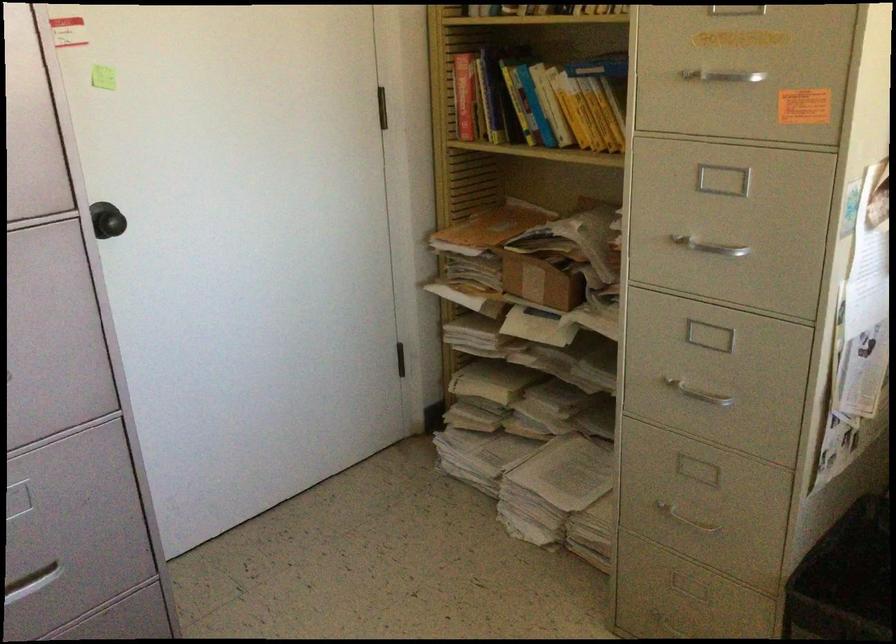
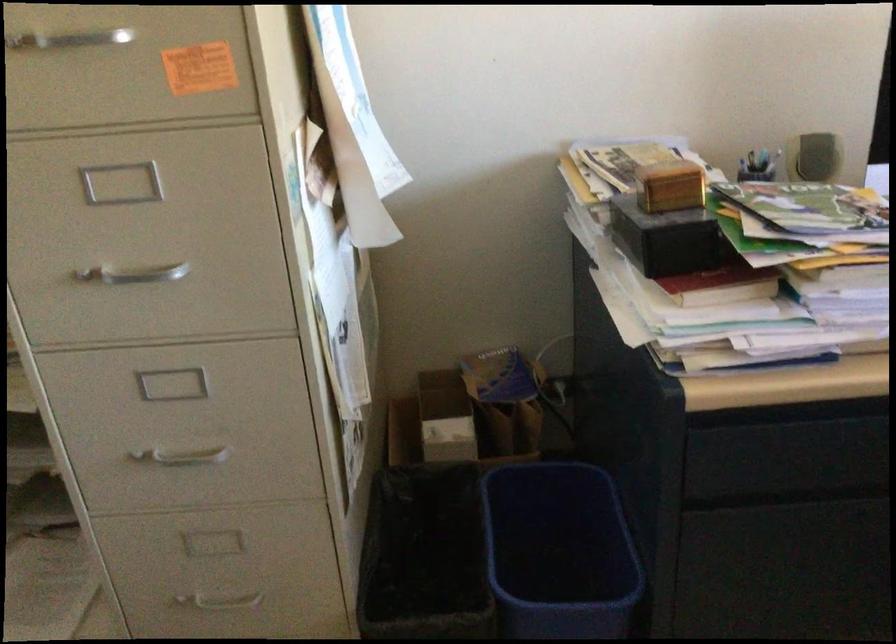
Where in the second image is the point corresponding to [703,249] from the first image?

(134, 274)